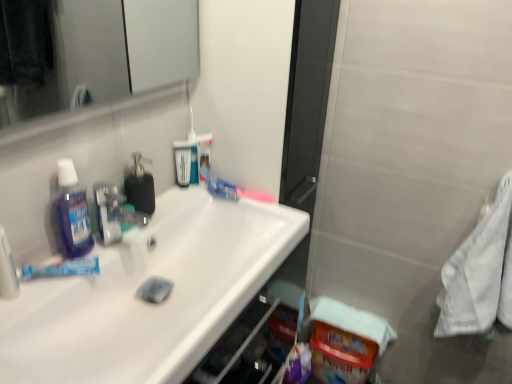
Find the location of a particular element. free point in front of blue glossy mouthwash at upper center, which is the 1th mouthwash from back to front is located at coordinates (184, 201).